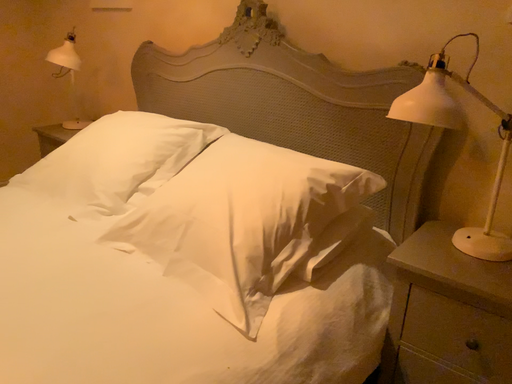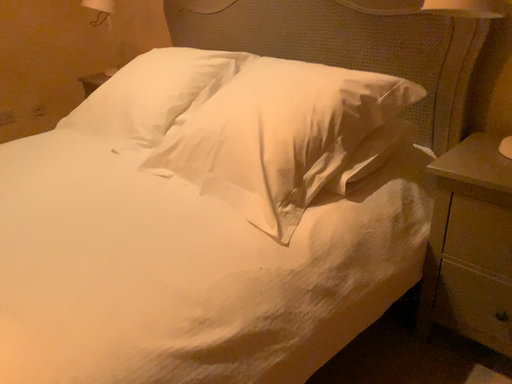
Question: How did the camera likely rotate when shooting the video?

Choices:
 (A) rotated downward
 (B) rotated upward

Answer: (A)